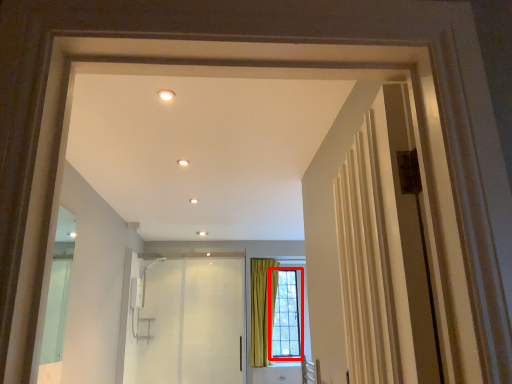
Question: Considering the relative positions of window (annotated by the red box) and elevator in the image provided, where is window (annotated by the red box) located with respect to the staircase?

Choices:
 (A) left
 (B) right

Answer: (B)